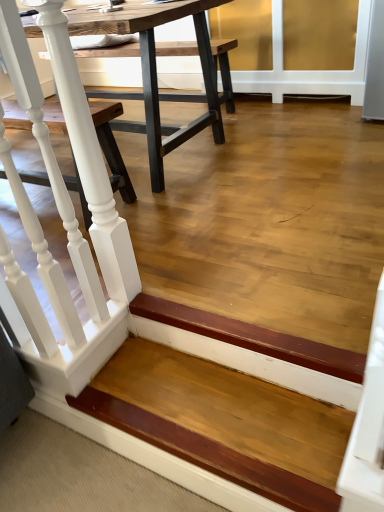
At what (x,y) coordinates should I click in order to perform the action: click on wooden table at center. Please return your answer as a coordinate pair (x, y). This screenshot has width=384, height=512. Looking at the image, I should click on (156, 71).

What do you see at coordinates (156, 71) in the screenshot? I see `wooden table at center` at bounding box center [156, 71].

Find the location of a particular element. wooden step at lower left is located at coordinates (224, 422).

Can you confirm if white painted wood railing at left is shorter than wooden step at lower left?

No.

Considering the points (77, 325) and (339, 409), which point is behind, point (77, 325) or point (339, 409)?

Point (77, 325)

Measure the distance from white painted wood railing at left to wooden step at lower left.

white painted wood railing at left is 16.02 inches away from wooden step at lower left.

Choose the correct answer: Is white painted wood railing at left inside wooden step at lower left or outside it?

white painted wood railing at left is spatially situated outside wooden step at lower left.

How many degrees apart are the facing directions of wooden table at center and wooden step at lower left?

The angular difference between wooden table at center and wooden step at lower left is 2.67 degrees.

Find the location of a particular element. Image resolution: width=384 pixels, height=512 pixels. stairwell in front of the wooden table at center is located at coordinates point(224,422).

From the image's perspective, which one is positioned higher, wooden table at center or wooden step at lower left?

wooden table at center, from the image's perspective.

How many degrees apart are the facing directions of wooden table at center and white painted wood railing at left?

The angular difference between wooden table at center and white painted wood railing at left is 91.5 degrees.

Is wooden table at center looking in the opposite direction of white painted wood railing at left?

wooden table at center is not turned away from white painted wood railing at left.

The height and width of the screenshot is (512, 384). What are the coordinates of `table above the white painted wood railing at left (from the image's perspective)` in the screenshot? It's located at (156, 71).

From a real-world perspective, which is physically below, wooden table at center or white painted wood railing at left?

wooden table at center, from a real-world perspective.

Is wooden step at lower left facing towards white painted wood railing at left?

No, wooden step at lower left is not facing towards white painted wood railing at left.

Considering the positions of point (196, 463) and point (23, 205), is point (196, 463) closer or farther from the camera than point (23, 205)?

Point (196, 463).

Considering the relative sizes of wooden step at lower left and white painted wood railing at left in the image provided, is wooden step at lower left bigger than white painted wood railing at left?

Actually, wooden step at lower left might be smaller than white painted wood railing at left.

Which object is further away from the camera taking this photo, white painted wood railing at left or wooden table at center?

wooden table at center is more distant.

From the image's perspective, would you say white painted wood railing at left is positioned over wooden table at center?

Actually, white painted wood railing at left appears below wooden table at center in the image.

Is white painted wood railing at left to the right of wooden table at center from the viewer's perspective?

Yes.

This screenshot has width=384, height=512. I want to click on table below the white painted wood railing at left (from a real-world perspective), so click(156, 71).

Which is behind, point (167, 369) or point (219, 101)?

The point (219, 101) is farther from the camera.

From the picture: From a real-world perspective, is wooden step at lower left positioned under wooden table at center based on gravity?

Yes, from a real-world perspective, wooden step at lower left is beneath wooden table at center.

Considering the relative sizes of wooden step at lower left and wooden table at center in the image provided, is wooden step at lower left wider than wooden table at center?

No.

Image resolution: width=384 pixels, height=512 pixels. In order to click on rail on the left of the wooden step at lower left in this screenshot , I will do `click(75, 234)`.

Where is `table behind the wooden step at lower left`? The image size is (384, 512). table behind the wooden step at lower left is located at coordinates click(156, 71).

Based on their spatial positions, is wooden table at center or wooden step at lower left closer to white painted wood railing at left?

wooden step at lower left is closer to white painted wood railing at left.

Considering their positions, is white painted wood railing at left positioned further to wooden step at lower left than wooden table at center?

wooden table at center is further to wooden step at lower left.

Looking at this image, when comparing their distances from wooden table at center, does white painted wood railing at left or wooden step at lower left seem closer?

The object closer to wooden table at center is white painted wood railing at left.

Looking at the image, which one is located further to wooden table at center, wooden step at lower left or white painted wood railing at left?

wooden step at lower left.

Estimate the real-world distances between objects in this image. Which object is closer to white painted wood railing at left, wooden step at lower left or wooden table at center?

wooden step at lower left.

When comparing their distances from wooden step at lower left, does wooden table at center or white painted wood railing at left seem closer?

white painted wood railing at left is closer to wooden step at lower left.

At what (x,y) coordinates should I click in order to perform the action: click on rail that lies between wooden table at center and wooden step at lower left from top to bottom. Please return your answer as a coordinate pair (x, y). Image resolution: width=384 pixels, height=512 pixels. Looking at the image, I should click on click(75, 234).